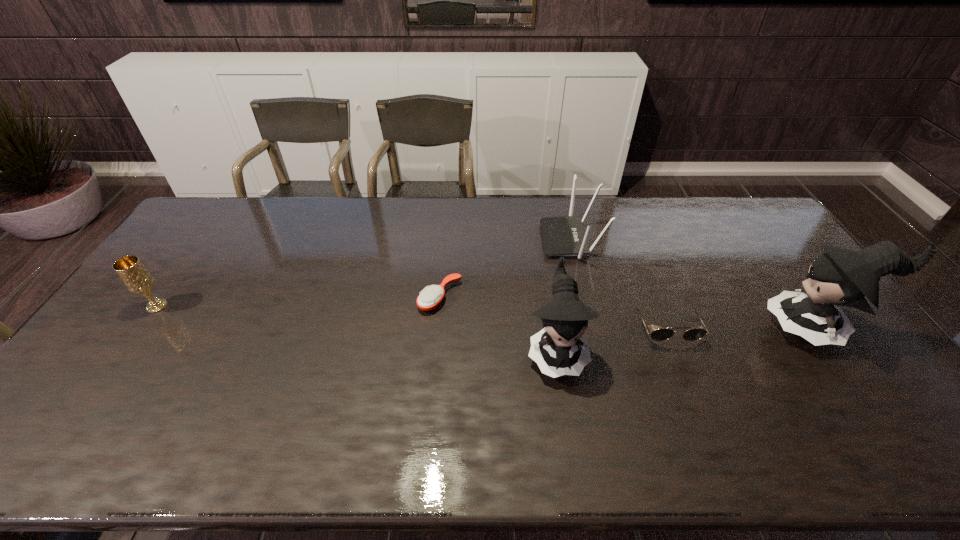
Locate an element on the screen. vacant space in between the sunglasses and the rightmost object is located at coordinates (740, 327).

Where is `unoccupied area between the hairbrush and the router`? unoccupied area between the hairbrush and the router is located at coordinates (505, 268).

Find the location of a particular element. The width and height of the screenshot is (960, 540). free area in between the right doll and the chalice is located at coordinates (487, 317).

You are a GUI agent. You are given a task and a screenshot of the screen. Output one action in this format:
    pyautogui.click(x=<x>, y=<y>)
    Task: Click on the vacant space that's between the rightmost object and the second object from right to left
    The image size is (960, 540).
    Given the screenshot: What is the action you would take?
    pyautogui.click(x=740, y=327)

The height and width of the screenshot is (540, 960). Identify the location of unoccupied position between the shorter doll and the leftmost object. (357, 328).

At what (x,y) coordinates should I click in order to perform the action: click on vacant area that lies between the sunglasses and the tallest object. Please return your answer as a coordinate pair (x, y). This screenshot has height=540, width=960. Looking at the image, I should click on (740, 327).

Identify the location of unoccupied position between the hairbrush and the fifth shortest object. Image resolution: width=960 pixels, height=540 pixels. [498, 323].

Where is `free spot between the second shortest object and the router`? This screenshot has height=540, width=960. free spot between the second shortest object and the router is located at coordinates (618, 283).

Select which object appears as the fourth closest to the leftmost object. Please provide its 2D coordinates. Your answer should be formatted as a tuple, i.e. [(x, y)], where the tuple contains the x and y coordinates of a point satisfying the conditions above.

[(661, 334)]

This screenshot has height=540, width=960. Find the location of `the fifth closest object to the left doll`. the fifth closest object to the left doll is located at coordinates (137, 279).